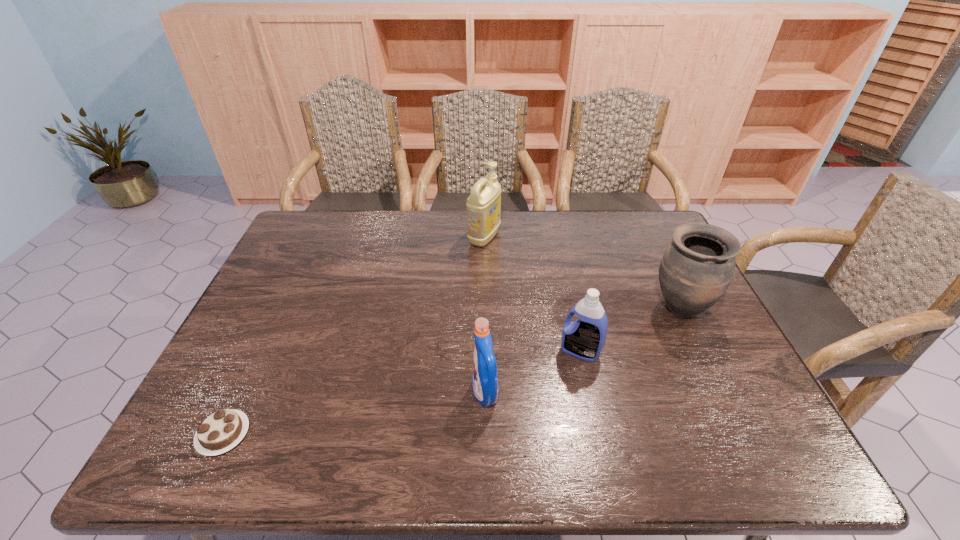
In order to click on vacant region that satisfies the following two spatial constraints: 1. on the front side of the fourth nearest object; 2. on the left side of the farthest detergent in this screenshot , I will do `click(485, 309)`.

The width and height of the screenshot is (960, 540). Identify the location of vacant space that satisfies the following two spatial constraints: 1. on the front side of the rightmost object; 2. on the label of the nearest detergent. (719, 393).

You are a GUI agent. You are given a task and a screenshot of the screen. Output one action in this format:
    pyautogui.click(x=<x>, y=<y>)
    Task: Click on the free space that satisfies the following two spatial constraints: 1. on the back side of the chocolate cake; 2. on the right side of the rightmost detergent
    This screenshot has width=960, height=540.
    Given the screenshot: What is the action you would take?
    pyautogui.click(x=263, y=351)